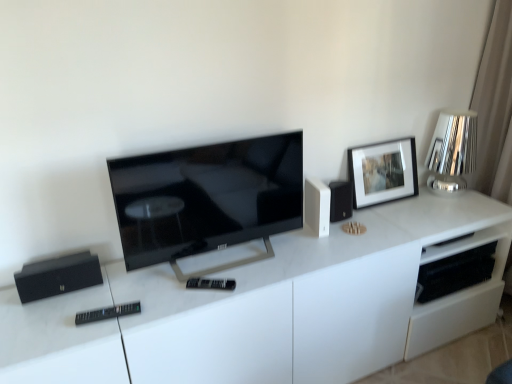
Locate an element on the screen. The image size is (512, 384). vacant space to the right of black plastic remote at center, placed as the second remote when sorted from left to right is located at coordinates (253, 284).